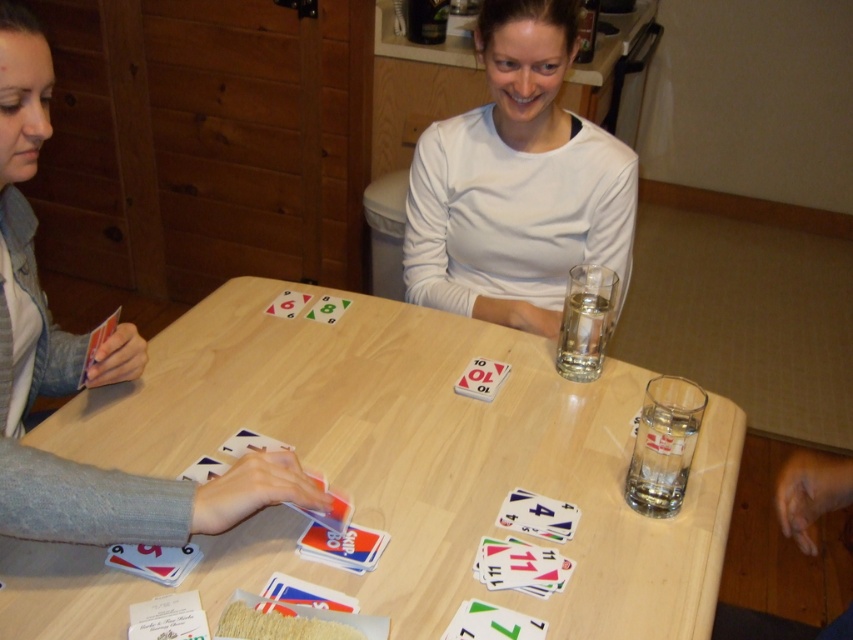
You are a photographer setting up a shoot at the table. You need to ensure that the white matte shirt at upper center and the matte plastic card at center are both visible in the frame. Given their sizes, which object will require more space in the composition?

The white matte shirt at upper center requires more space in the composition because its width is larger than the matte plastic card at center.

You are a game organizer who needs to ensure the cards are placed within a 25 inch radius of each other for the game to start. You see the smooth plastic cards at lower left and the green matte card at center. Are they within the required distance?

The smooth plastic cards at lower left is 20.70 inches from green matte card at center, which is within the 25 inch radius requirement. The cards are placed within the required distance.